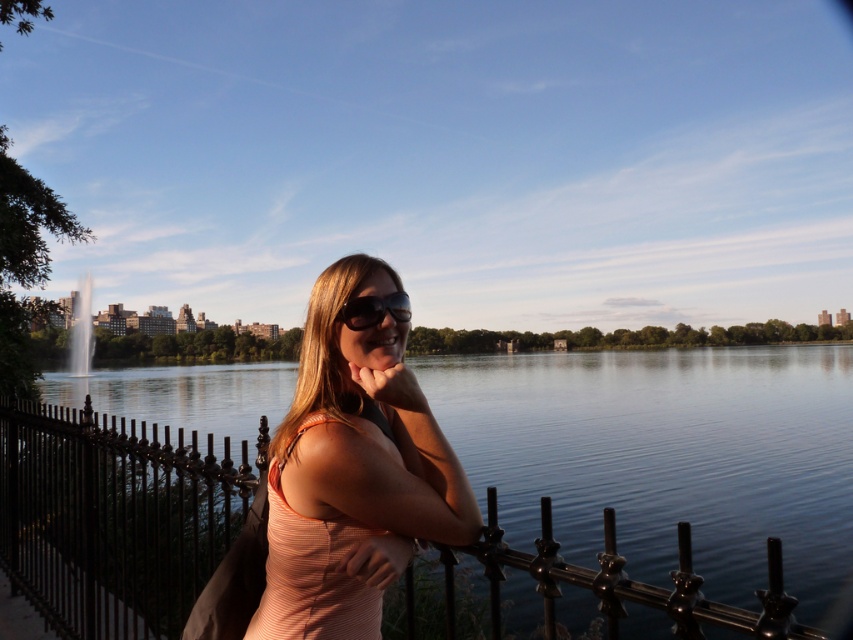
You are standing in the park scene and want to place a small flowerpot between the two points, point (302, 556) and point (74, 316). Which point should the flowerpot be closer to in order to be nearer to the viewer?

The flowerpot should be closer to point (302, 556) since it is nearer to the viewer compared to point (74, 316).

You are a photographer trying to capture the shiny black sunglasses at center and the shiny silver fountain at center in a single shot. Which object will appear larger in the photo?

The shiny black sunglasses at center will appear larger in the photo because it is closer to the viewer than the shiny silver fountain at center.